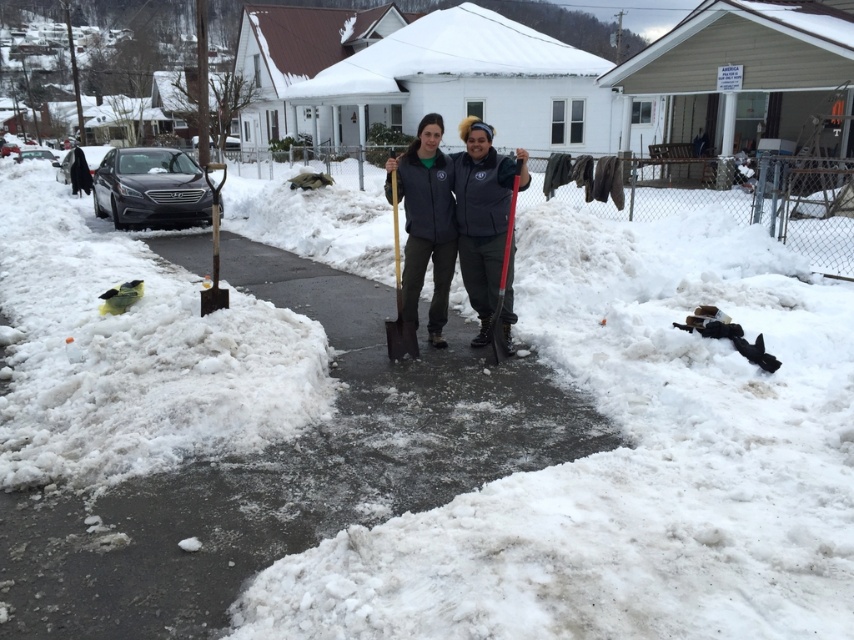
Question: Does matte gray jacket at center come in front of wooden shovel at center?

Choices:
 (A) no
 (B) yes

Answer: (B)

Question: Does dark gray fleece jackets at center have a lesser width compared to matte gray jacket at center?

Choices:
 (A) no
 (B) yes

Answer: (B)

Question: Is matte gray jacket at center to the right of wooden shovel at center from the viewer's perspective?

Choices:
 (A) yes
 (B) no

Answer: (B)

Question: Which of the following is the farthest from the observer?

Choices:
 (A) dark gray fleece jackets at center
 (B) matte gray jacket at center
 (C) wooden shovel at center
 (D) red plastic shovel at center

Answer: (C)

Question: Which object is closer to the camera taking this photo?

Choices:
 (A) red plastic shovel at center
 (B) dark gray fleece jackets at center

Answer: (A)

Question: Which object is positioned farthest from the dark gray fleece jackets at center?

Choices:
 (A) red plastic shovel at center
 (B) wooden shovel at center
 (C) matte gray jacket at center

Answer: (C)